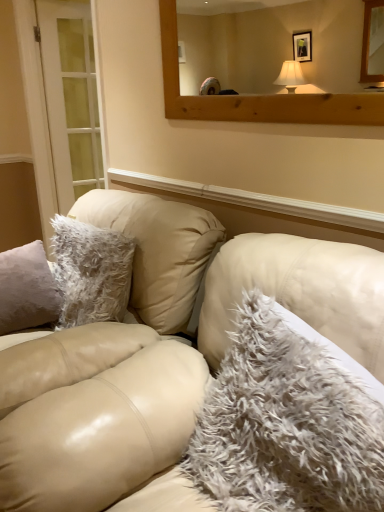
Question: Is leather couch at center closer to camera compared to white glass door at left?

Choices:
 (A) yes
 (B) no

Answer: (A)

Question: From a real-world perspective, is leather couch at center positioned under white glass door at left based on gravity?

Choices:
 (A) no
 (B) yes

Answer: (B)

Question: From the image's perspective, is leather couch at center on white glass door at left?

Choices:
 (A) yes
 (B) no

Answer: (B)

Question: Considering the relative sizes of leather couch at center and white glass door at left in the image provided, is leather couch at center wider than white glass door at left?

Choices:
 (A) yes
 (B) no

Answer: (A)

Question: Considering the relative sizes of leather couch at center and white glass door at left in the image provided, is leather couch at center smaller than white glass door at left?

Choices:
 (A) no
 (B) yes

Answer: (A)

Question: Would you say leather couch at center is inside or outside wooden mirror at upper center?

Choices:
 (A) outside
 (B) inside

Answer: (A)

Question: From the image's perspective, is leather couch at center positioned above or below wooden mirror at upper center?

Choices:
 (A) below
 (B) above

Answer: (A)

Question: In the image, is leather couch at center on the left side or the right side of wooden mirror at upper center?

Choices:
 (A) right
 (B) left

Answer: (B)

Question: Looking at their shapes, would you say leather couch at center is wider or thinner than wooden mirror at upper center?

Choices:
 (A) thin
 (B) wide

Answer: (B)

Question: Based on their sizes in the image, would you say wooden mirror at upper center is bigger or smaller than white glass door at left?

Choices:
 (A) small
 (B) big

Answer: (A)

Question: Which is correct: wooden mirror at upper center is inside white glass door at left, or outside of it?

Choices:
 (A) outside
 (B) inside

Answer: (A)

Question: Is wooden mirror at upper center in front of or behind white glass door at left in the image?

Choices:
 (A) behind
 (B) front

Answer: (B)

Question: From the image's perspective, is wooden mirror at upper center positioned above or below white glass door at left?

Choices:
 (A) below
 (B) above

Answer: (A)

Question: From a real-world perspective, is fuzzy white pillow at center above or below leather couch at center?

Choices:
 (A) below
 (B) above

Answer: (B)

Question: Visually, is fuzzy white pillow at center positioned to the left or to the right of leather couch at center?

Choices:
 (A) right
 (B) left

Answer: (A)